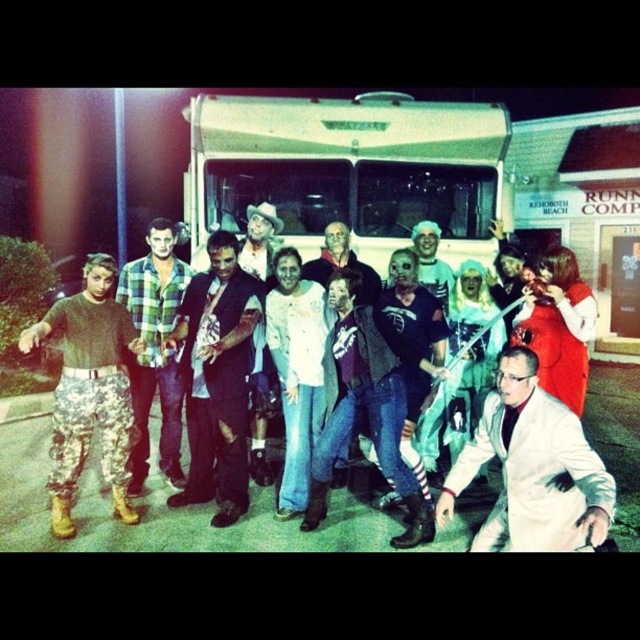
You are a photographer at the scene and want to take a photo that includes both the white matte lab coat at lower right and the green plaid shirt at center. Which of the two items should you focus on first to ensure both are in sharp focus?

The white matte lab coat at lower right is closer to the viewer than the green plaid shirt at center. To ensure both are in sharp focus, focus on the white matte lab coat at lower right first, as it is closer, and the green plaid shirt at center will fall within the depth of field.

You are a photographer at the scene and want to ensure both the denim jeans at center and the matte black hat at center are clearly visible in your photo. Given their height difference, which object should you focus on first to ensure proper framing?

The denim jeans at center has a greater height compared to matte black hat at center, so you should focus on the denim jeans at center first to ensure proper framing since it is taller and occupies more vertical space.